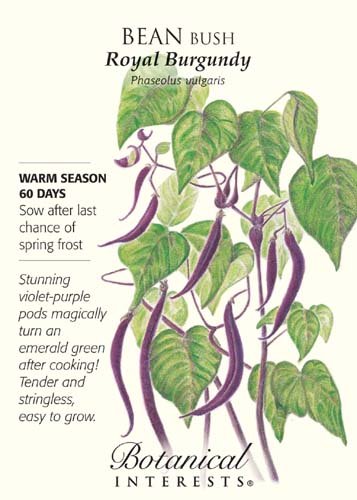
Locate an element on the screen. The image size is (357, 500). artwork is located at coordinates (197, 363).